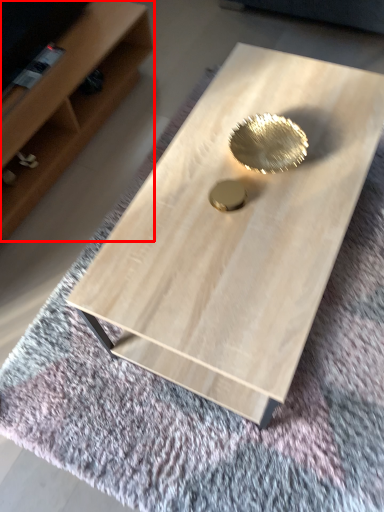
Question: From the image's perspective, what is the correct spatial relationship of shelf (annotated by the red box) in relation to coffee table?

Choices:
 (A) above
 (B) below

Answer: (A)